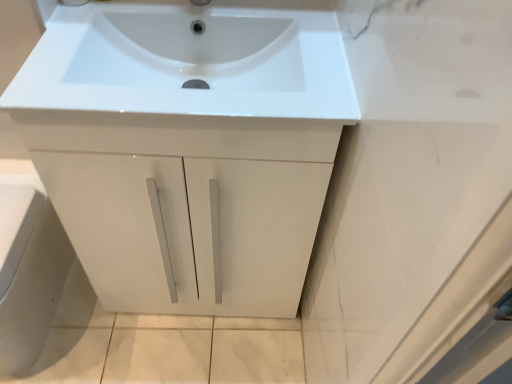
Question: In the image, is white glossy sink at center positioned in front of or behind white glossy cabinet door at lower left?

Choices:
 (A) behind
 (B) front

Answer: (B)

Question: From the image's perspective, relative to white glossy cabinet door at lower left, is white glossy sink at center above or below?

Choices:
 (A) above
 (B) below

Answer: (A)

Question: In terms of width, does white glossy sink at center look wider or thinner when compared to white glossy cabinet door at lower left?

Choices:
 (A) thin
 (B) wide

Answer: (A)

Question: Is white glossy cabinet door at lower left wider or thinner than white glossy sink at center?

Choices:
 (A) wide
 (B) thin

Answer: (A)

Question: Considering their positions, is white glossy cabinet door at lower left located in front of or behind white glossy sink at center?

Choices:
 (A) behind
 (B) front

Answer: (A)

Question: In terms of height, does white glossy cabinet door at lower left look taller or shorter compared to white glossy sink at center?

Choices:
 (A) tall
 (B) short

Answer: (A)

Question: Considering the relative positions of white glossy cabinet door at lower left and white glossy sink at center in the image provided, is white glossy cabinet door at lower left to the left or to the right of white glossy sink at center?

Choices:
 (A) right
 (B) left

Answer: (B)